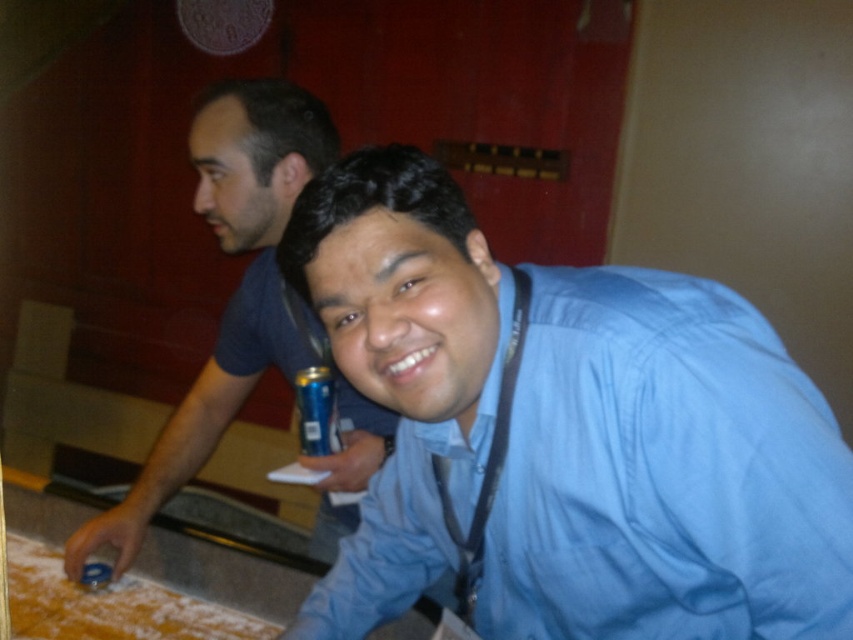
Between blue shirt at center and white powdery flour at lower left, which one has more height?

Standing taller between the two is blue shirt at center.

Who is positioned more to the left, blue shirt at center or white powdery flour at lower left?

From the viewer's perspective, white powdery flour at lower left appears more on the left side.

Locate an element on the screen. This screenshot has width=853, height=640. blue shirt at center is located at coordinates (663, 472).

Which is below, white powdery flour at lower left or blue metallic can at center?

white powdery flour at lower left is lower down.

Does white powdery flour at lower left have a lesser width compared to blue metallic can at center?

No, white powdery flour at lower left is not thinner than blue metallic can at center.

What do you see at coordinates (109, 605) in the screenshot?
I see `white powdery flour at lower left` at bounding box center [109, 605].

Identify the location of white powdery flour at lower left. (109, 605).

Which is more to the left, blue shirt at center or blue denim shirt at center?

Positioned to the left is blue denim shirt at center.

Describe the element at coordinates (663, 472) in the screenshot. I see `blue shirt at center` at that location.

Is point (770, 515) in front of point (201, 204)?

That is True.

Image resolution: width=853 pixels, height=640 pixels. In order to click on blue shirt at center in this screenshot , I will do `click(663, 472)`.